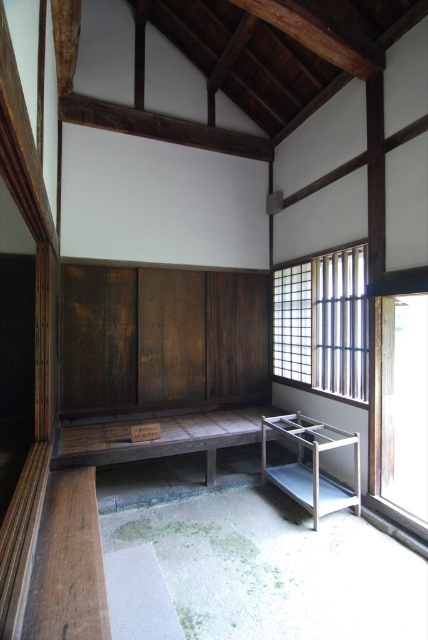
You are standing in the traditional Japanese room and want to place a small decoration between the two points, point (345, 381) and point (389, 348). Which point is closer to you so that the decoration can be placed in front of it?

Point (389, 348) is closer to you than point (345, 381), so the decoration should be placed in front of point (389, 348).